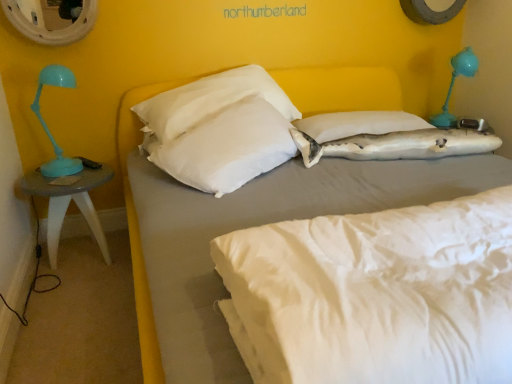
Question: Considering the relative positions of white fabric mattress at center and white matte bed at center in the image provided, is white fabric mattress at center behind white matte bed at center?

Choices:
 (A) yes
 (B) no

Answer: (A)

Question: Is white fabric mattress at center bigger than white matte bed at center?

Choices:
 (A) yes
 (B) no

Answer: (B)

Question: Is white fabric mattress at center positioned beyond the bounds of white matte bed at center?

Choices:
 (A) no
 (B) yes

Answer: (A)

Question: Is white fabric mattress at center oriented towards white matte bed at center?

Choices:
 (A) yes
 (B) no

Answer: (A)

Question: Considering the relative sizes of white fabric mattress at center and white matte bed at center in the image provided, is white fabric mattress at center wider than white matte bed at center?

Choices:
 (A) yes
 (B) no

Answer: (B)

Question: Would you say white fabric mattress at center is a long distance from white matte bed at center?

Choices:
 (A) yes
 (B) no

Answer: (A)

Question: Is white fabric mattress at center facing towards white soft pillow at center, the 1th pillow in the left-to-right sequence?

Choices:
 (A) yes
 (B) no

Answer: (B)

Question: Is white fabric mattress at center oriented away from white soft pillow at center, which is the third pillow from right to left?

Choices:
 (A) yes
 (B) no

Answer: (A)

Question: From a real-world perspective, does white fabric mattress at center stand above white soft pillow at center, which is the third pillow from right to left?

Choices:
 (A) yes
 (B) no

Answer: (B)

Question: Can you confirm if white fabric mattress at center is thinner than white soft pillow at center, which is the third pillow from right to left?

Choices:
 (A) yes
 (B) no

Answer: (B)

Question: Does white fabric mattress at center come behind white soft pillow at center, the 1th pillow in the left-to-right sequence?

Choices:
 (A) yes
 (B) no

Answer: (B)

Question: Considering the relative sizes of white fabric mattress at center and white soft pillow at center, which is the third pillow from right to left, in the image provided, is white fabric mattress at center bigger than white soft pillow at center, which is the third pillow from right to left,?

Choices:
 (A) yes
 (B) no

Answer: (A)

Question: From the image's perspective, is white fabric shark at center, which is the 1th pillow in right-to-left order, beneath metallic circular mirror at upper left?

Choices:
 (A) no
 (B) yes

Answer: (B)